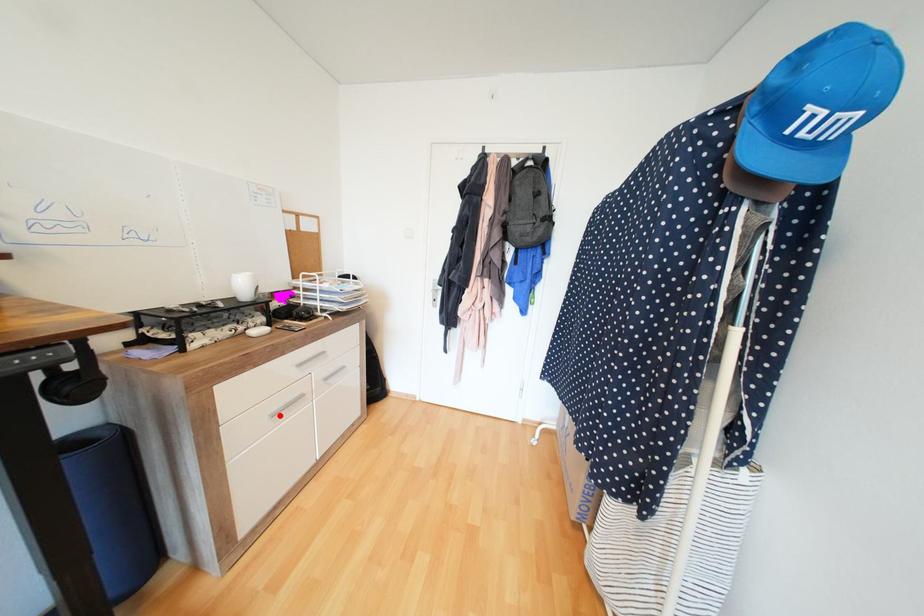
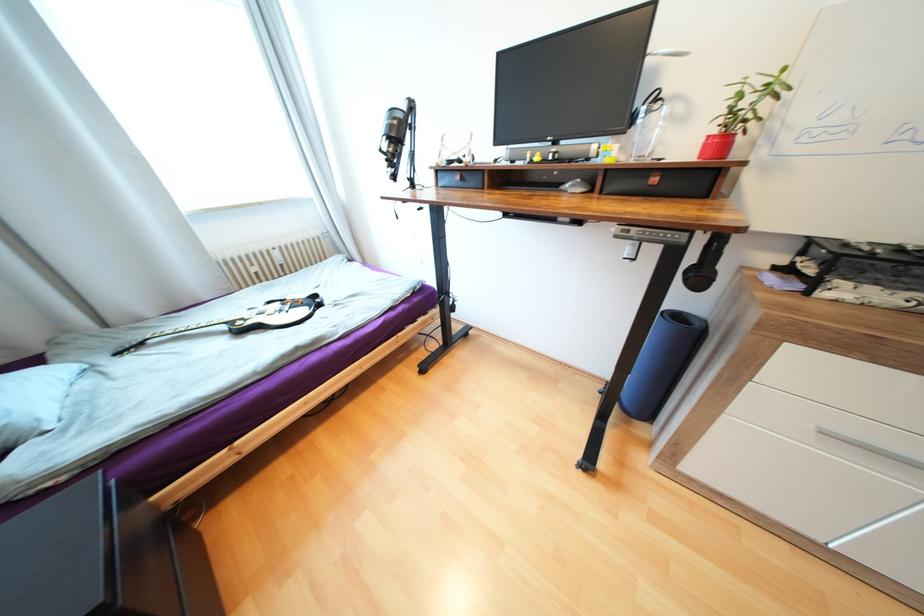
The point at the highlighted location is marked in the first image. Where is the corresponding point in the second image?

(830, 432)